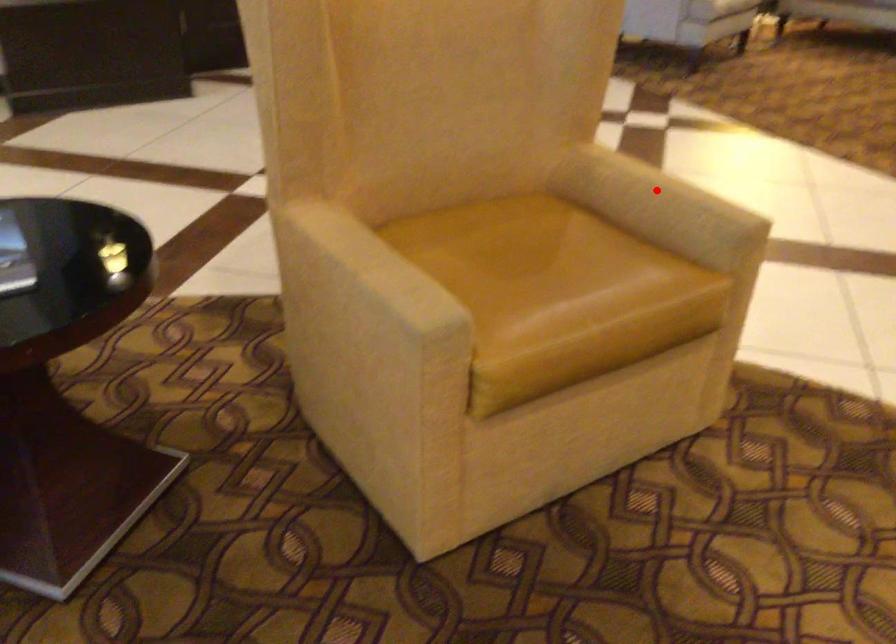
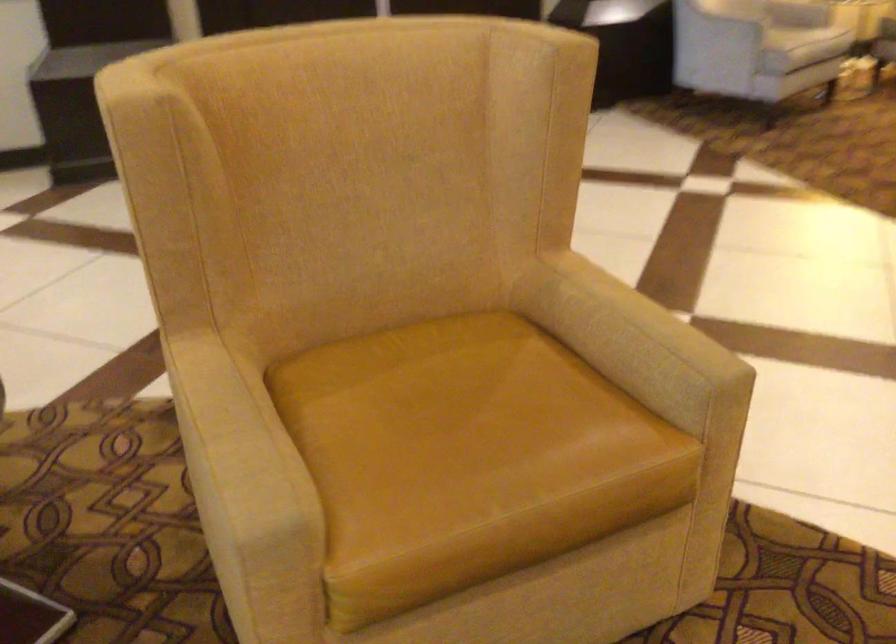
Where in the second image is the point corresponding to the highlighted location from the first image?

(624, 322)